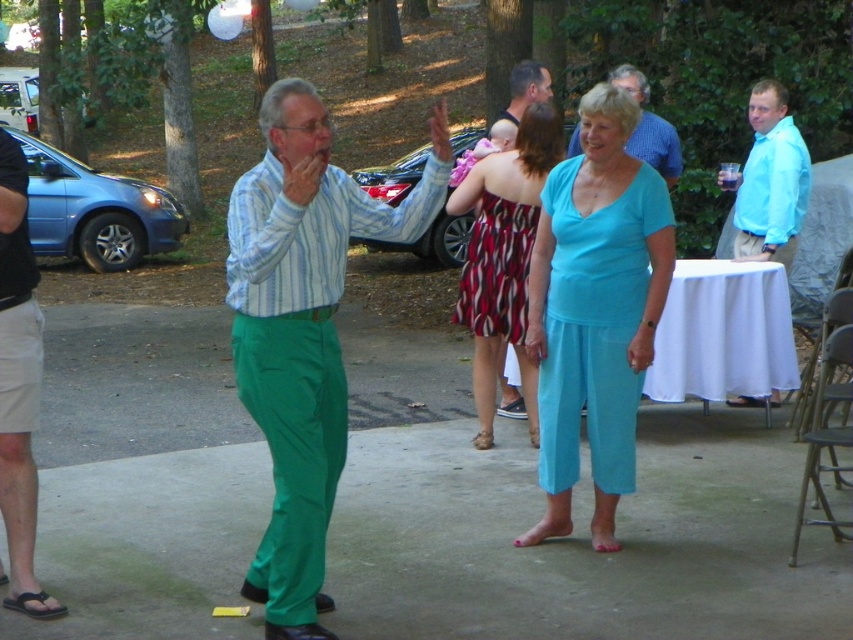
Question: Does matte green pants at center appear under brown leather sandal at lower left?

Choices:
 (A) yes
 (B) no

Answer: (B)

Question: Among these objects, which one is farthest from the camera?

Choices:
 (A) red and black striped dress at center
 (B) matte blue shirt at center
 (C) dark green shorts at left
 (D) matte green pants at center

Answer: (B)

Question: Which point is farther to the camera?

Choices:
 (A) printed fabric dress at center
 (B) brown leather sandal at lower left

Answer: (A)

Question: Can you confirm if dark green shorts at left is thinner than matte blue shirt at center?

Choices:
 (A) no
 (B) yes

Answer: (B)

Question: Is teal fabric pants at center smaller than printed fabric dress at center?

Choices:
 (A) yes
 (B) no

Answer: (A)

Question: Estimate the real-world distances between objects in this image. Which object is farther from the brown leather sandal at lower left?

Choices:
 (A) teal fabric pants at center
 (B) dark green shorts at left
 (C) matte blue shirt at center

Answer: (C)